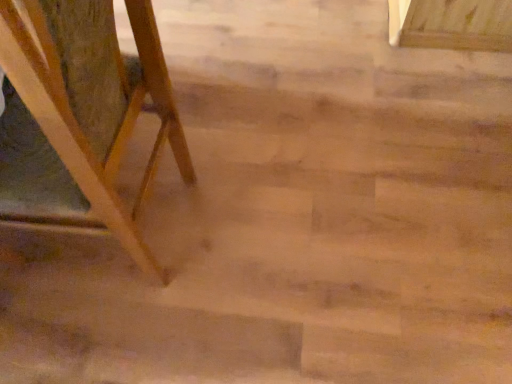
Where is `vacant area situated below wooden easel at left (from a real-world perspective)`? vacant area situated below wooden easel at left (from a real-world perspective) is located at coordinates (117, 241).